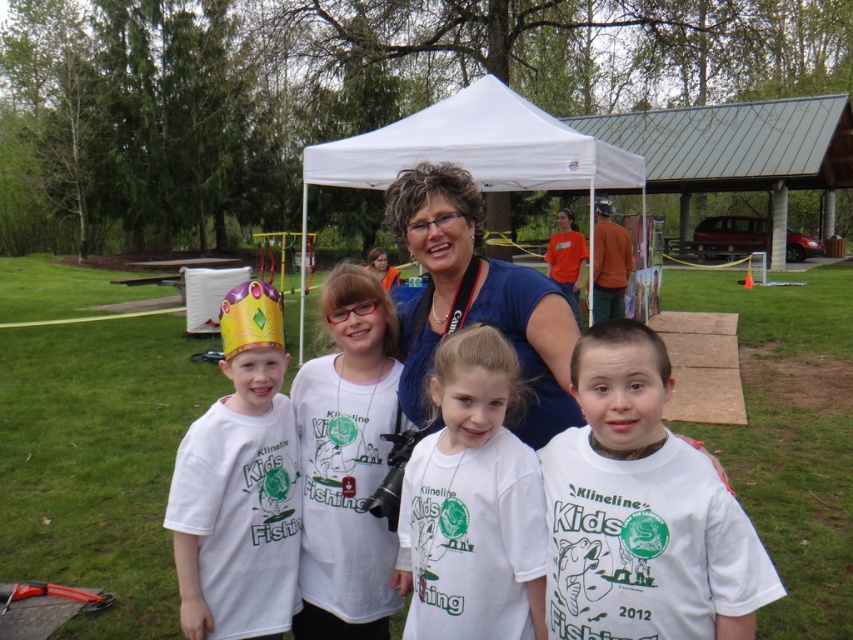
Question: Which point is closer to the camera?

Choices:
 (A) (224, 310)
 (B) (421, 230)
 (C) (532, 298)
 (D) (589, 154)

Answer: (C)

Question: Does white matte shirt at center appear on the left side of blue fabric at center?

Choices:
 (A) no
 (B) yes

Answer: (A)

Question: Among these objects, which one is farthest from the camera?

Choices:
 (A) white cotton shirt at center
 (B) blue fabric at center
 (C) white cotton t-shirts at center

Answer: (B)

Question: Does white cotton t-shirts at center have a larger size compared to white fabric tent at center?

Choices:
 (A) yes
 (B) no

Answer: (B)

Question: Where is white cotton shirt at center located in relation to white fabric tent at center in the image?

Choices:
 (A) right
 (B) left

Answer: (A)

Question: Which point is closer to the camera taking this photo?

Choices:
 (A) (431, 260)
 (B) (428, 109)
 (C) (434, 241)

Answer: (C)